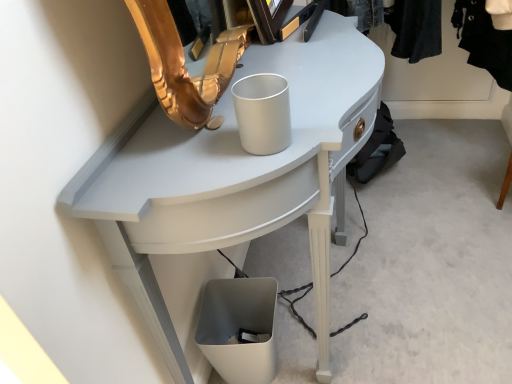
Identify the location of vacant area that lies to the right of white glossy desk at center. (435, 256).